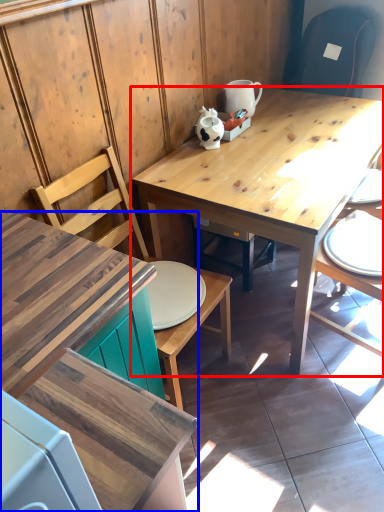
Question: Among these objects, which one is nearest to the camera, table (highlighted by a red box) or desk (highlighted by a blue box)?

Choices:
 (A) table
 (B) desk

Answer: (B)